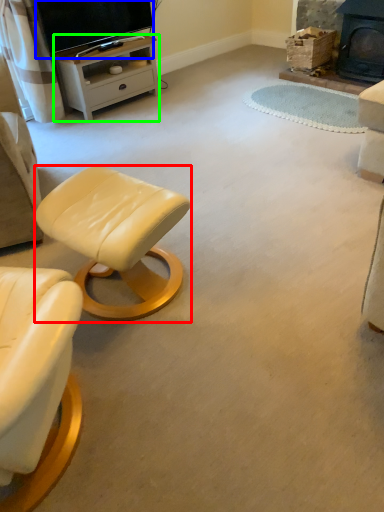
Question: Based on their relative distances, which object is farther from stool (highlighted by a red box)? Choose from television (highlighted by a blue box) and desk (highlighted by a green box).

Choices:
 (A) television
 (B) desk

Answer: (A)